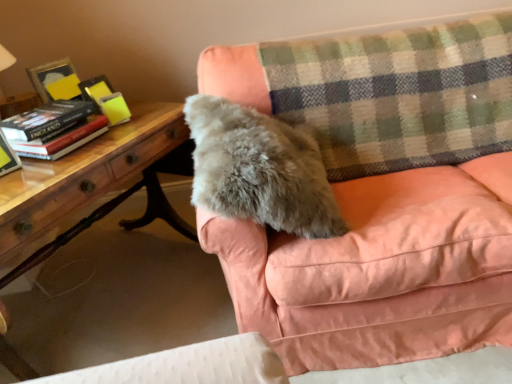
Question: Are hardcover book at left and hardcover book at left making contact?

Choices:
 (A) no
 (B) yes

Answer: (A)

Question: Does hardcover book at left have a lesser height compared to hardcover book at left?

Choices:
 (A) no
 (B) yes

Answer: (B)

Question: From the image's perspective, would you say hardcover book at left is shown under hardcover book at left?

Choices:
 (A) no
 (B) yes

Answer: (A)

Question: Is hardcover book at left bigger than hardcover book at left?

Choices:
 (A) yes
 (B) no

Answer: (A)

Question: From a real-world perspective, is hardcover book at left positioned under hardcover book at left based on gravity?

Choices:
 (A) no
 (B) yes

Answer: (B)

Question: Considering their positions, is green plaid blanket at upper right located in front of or behind hardcover book at left?

Choices:
 (A) front
 (B) behind

Answer: (B)

Question: Looking at the image, does green plaid blanket at upper right seem bigger or smaller compared to hardcover book at left?

Choices:
 (A) big
 (B) small

Answer: (A)

Question: From a real-world perspective, is green plaid blanket at upper right positioned above or below hardcover book at left?

Choices:
 (A) above
 (B) below

Answer: (B)

Question: Which is correct: green plaid blanket at upper right is inside hardcover book at left, or outside of it?

Choices:
 (A) outside
 (B) inside

Answer: (A)

Question: From a real-world perspective, is gray furry pillow at center positioned above or below green plaid blanket at upper right?

Choices:
 (A) below
 (B) above

Answer: (A)

Question: Is gray furry pillow at center situated inside green plaid blanket at upper right or outside?

Choices:
 (A) inside
 (B) outside

Answer: (B)

Question: From their relative heights in the image, would you say gray furry pillow at center is taller or shorter than green plaid blanket at upper right?

Choices:
 (A) tall
 (B) short

Answer: (B)

Question: From the image's perspective, relative to green plaid blanket at upper right, is gray furry pillow at center above or below?

Choices:
 (A) below
 (B) above

Answer: (A)

Question: From the image's perspective, is wooden table at left above or below gray furry pillow at center?

Choices:
 (A) above
 (B) below

Answer: (B)

Question: Considering the relative positions of wooden table at left and gray furry pillow at center in the image provided, is wooden table at left to the left or to the right of gray furry pillow at center?

Choices:
 (A) left
 (B) right

Answer: (A)